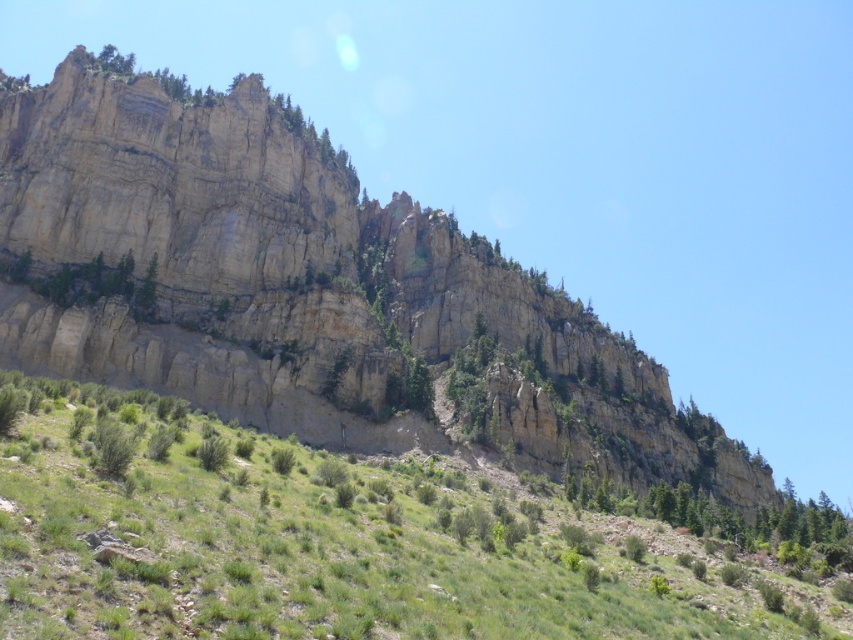
Question: Which of these objects is positioned farthest from the green matte tree at center?

Choices:
 (A) green grassy hillside at lower center
 (B) rugged stone mountain at upper center

Answer: (A)

Question: Considering the real-world distances, which object is farthest from the green matte tree at center?

Choices:
 (A) green grassy hillside at lower center
 (B) rugged stone mountain at upper center

Answer: (A)

Question: Is rugged stone mountain at upper center to the right of green grassy hillside at lower center from the viewer's perspective?

Choices:
 (A) no
 (B) yes

Answer: (A)

Question: Can you confirm if rugged stone mountain at upper center is positioned to the right of green grassy hillside at lower center?

Choices:
 (A) no
 (B) yes

Answer: (A)

Question: Which point is farther from the camera taking this photo?

Choices:
 (A) (683, 419)
 (B) (10, 275)
 (C) (48, 572)

Answer: (A)

Question: Is green grassy hillside at lower center smaller than green matte tree at center?

Choices:
 (A) yes
 (B) no

Answer: (B)